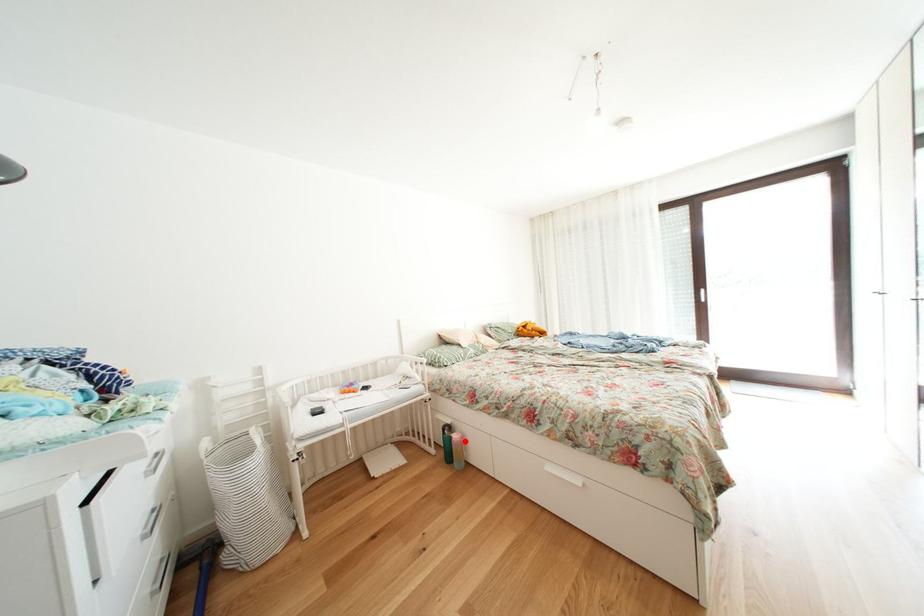
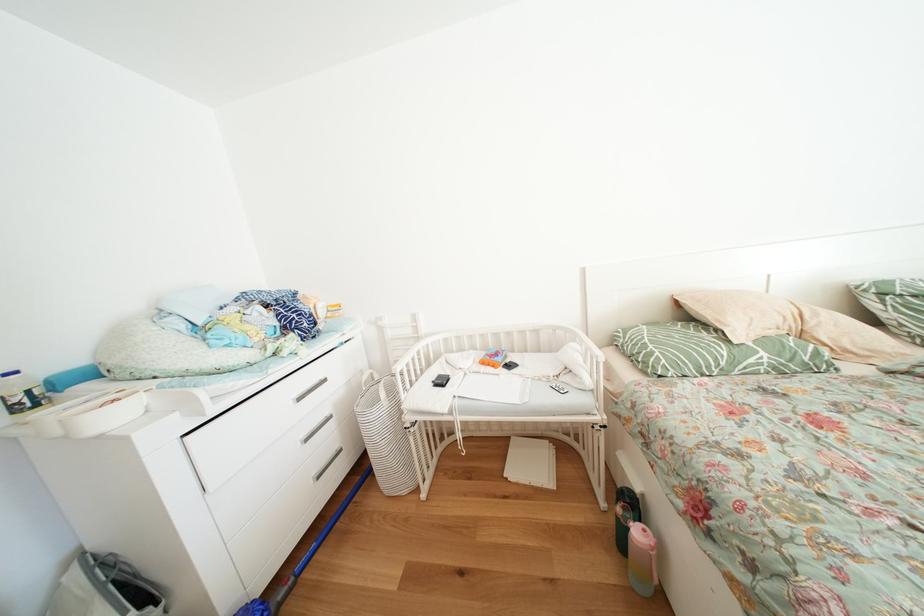
Where in the second image is the point corresponding to the highlighted location from the first image?

(648, 538)